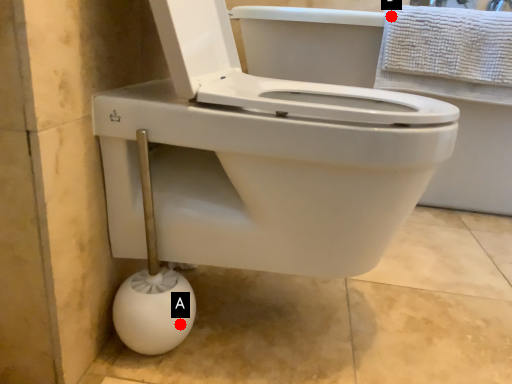
Question: Two points are circled on the image, labeled by A and B beside each circle. Among these points, which one is farthest from the camera?

Choices:
 (A) A is further
 (B) B is further

Answer: (B)